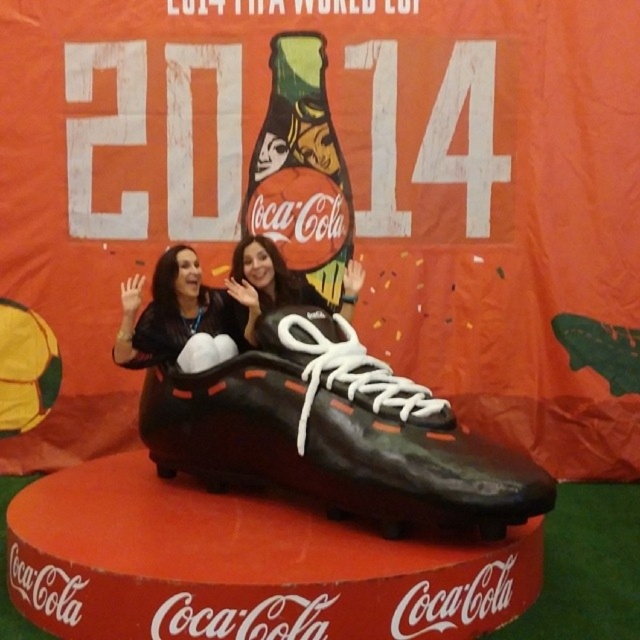
Who is higher up, green matte coca-cola bottle at center or black matte shoe at center?

A: green matte coca-cola bottle at center is higher up.

Does point (348, 248) lie in front of point (305, 353)?

No.

Where is `green matte coca-cola bottle at center`? green matte coca-cola bottle at center is located at coordinates (301, 170).

In the scene shown: Does black rubber shoe at center have a greater width compared to matte black top at center?

Yes.

The height and width of the screenshot is (640, 640). What do you see at coordinates (336, 433) in the screenshot? I see `black rubber shoe at center` at bounding box center [336, 433].

Identify the location of black rubber shoe at center. Image resolution: width=640 pixels, height=640 pixels. (336, 433).

Is black rubber shoe at center below black matte shoe at center?

Yes.

Locate an element on the screen. Image resolution: width=640 pixels, height=640 pixels. black rubber shoe at center is located at coordinates (336, 433).

Who is more distant from viewer, (268, 339) or (349, 388)?

Positioned behind is point (268, 339).

You are a GUI agent. You are given a task and a screenshot of the screen. Output one action in this format:
    pyautogui.click(x=<x>, y=<y>)
    Task: Click on the black rubber shoe at center
    Image resolution: width=640 pixels, height=640 pixels.
    Given the screenshot: What is the action you would take?
    pyautogui.click(x=336, y=433)